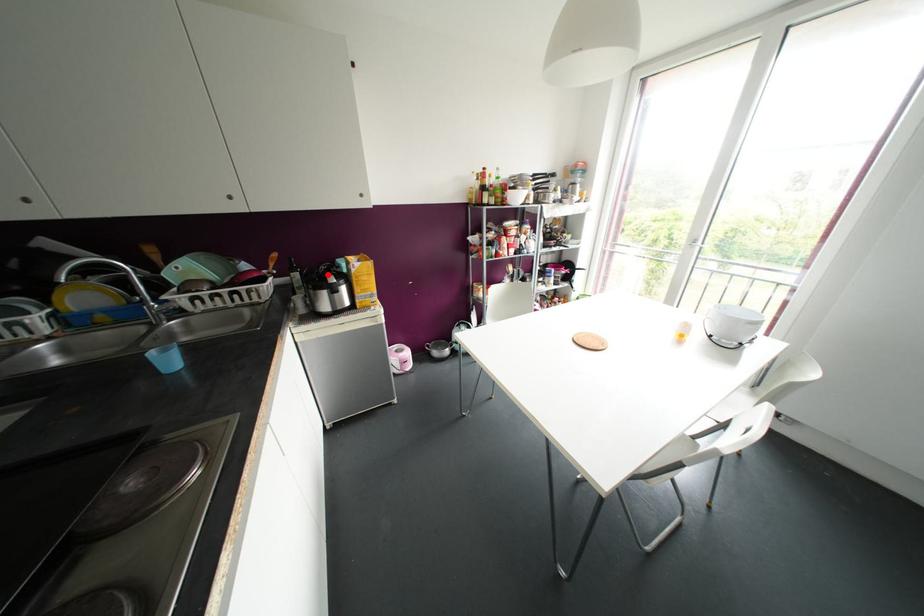
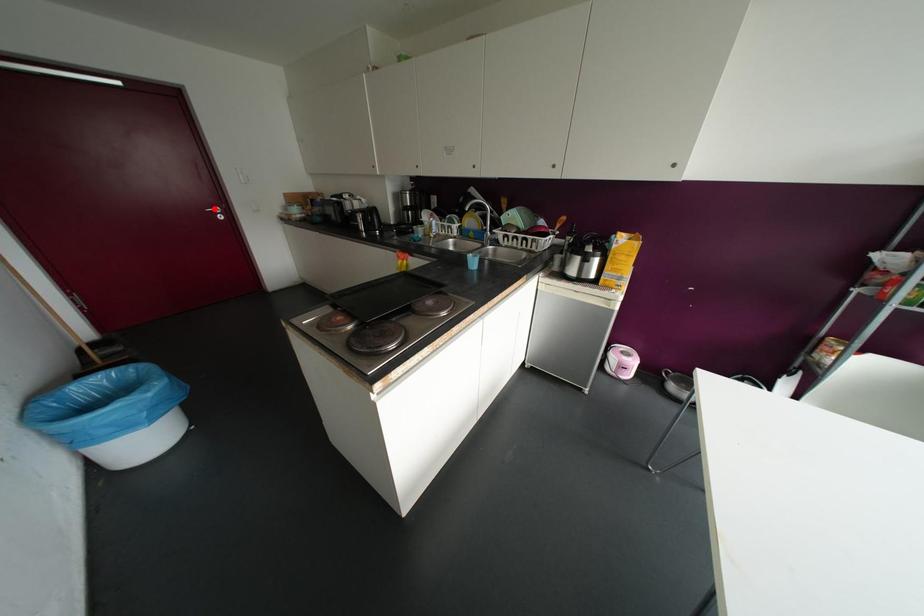
I am providing you with two images of the same scene from different viewpoints. A red point is marked on the first image and another point is marked on the second image. Are the points marked in image1 and image2 representing the same 3D position?

No